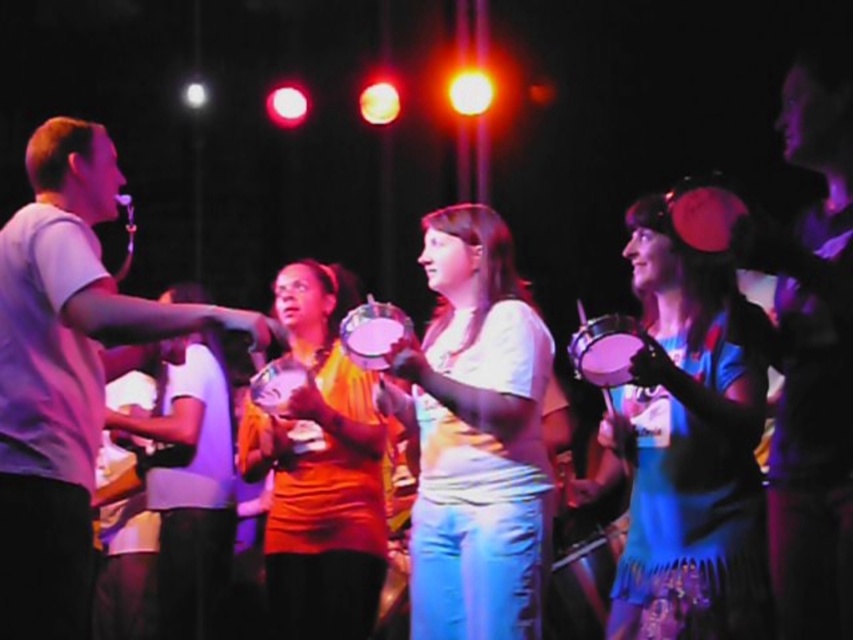
Question: Does orange matte drum at center have a lesser width compared to matte plastic tambourine at center?

Choices:
 (A) no
 (B) yes

Answer: (A)

Question: Does white matte shirt at center have a larger size compared to matte plastic tambourine at center?

Choices:
 (A) no
 (B) yes

Answer: (B)

Question: Which of these objects is positioned farthest from the matte plastic tambourine at center?

Choices:
 (A) matte white shirt at left
 (B) blue fabric tambourine at right

Answer: (B)

Question: From the image, what is the correct spatial relationship of white matte shirt at center in relation to matte plastic tambourine at center?

Choices:
 (A) left
 (B) right

Answer: (B)

Question: Which point is closer to the camera?

Choices:
 (A) 714,262
 (B) 271,572
 (C) 389,340

Answer: (A)

Question: Which object appears closest to the camera in this image?

Choices:
 (A) shiny metallic drum at center
 (B) blue fabric tambourine at right
 (C) white matte shirt at center
 (D) orange matte drum at center

Answer: (B)